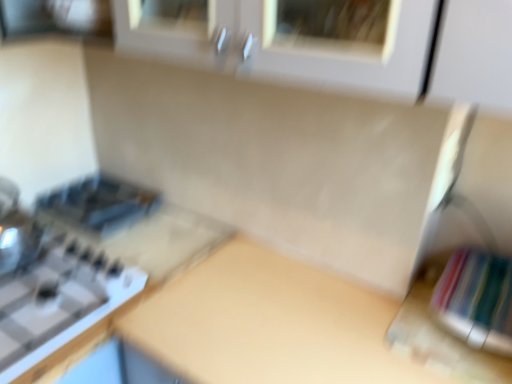
The height and width of the screenshot is (384, 512). I want to click on vacant space situated above white glossy gas stove at left (from a real-world perspective), so click(45, 285).